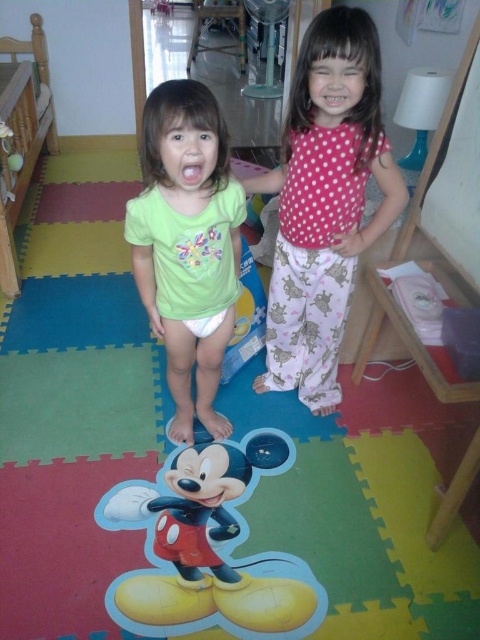
Is green matte shirt at center wider than wooden bed at left?

No, green matte shirt at center is not wider than wooden bed at left.

From the picture: Who is more forward, (214, 168) or (9, 61)?

Positioned in front is point (214, 168).

Is point (194, 264) behind point (6, 291)?

No.

Locate an element on the screen. Image resolution: width=480 pixels, height=640 pixels. green matte shirt at center is located at coordinates coord(188,243).

Can you confirm if pink dotted pajamas at center is positioned below wooden bed at left?

Correct, pink dotted pajamas at center is located below wooden bed at left.

Can you confirm if pink dotted pajamas at center is wider than wooden bed at left?

No, pink dotted pajamas at center is not wider than wooden bed at left.

Which is behind, point (285, 282) or point (35, 56)?

Positioned behind is point (35, 56).

I want to click on pink dotted pajamas at center, so click(324, 202).

Can you confirm if green matte shirt at center is positioned below shiny plastic mickey mouse at center?

No, green matte shirt at center is not below shiny plastic mickey mouse at center.

Does green matte shirt at center come behind shiny plastic mickey mouse at center?

No, it is in front of shiny plastic mickey mouse at center.

Is point (223, 268) farther from viewer compared to point (222, 449)?

No, it is not.

You are a GUI agent. You are given a task and a screenshot of the screen. Output one action in this format:
    pyautogui.click(x=<x>, y=<y>)
    Task: Click on the green matte shirt at center
    This screenshot has height=640, width=480.
    Given the screenshot: What is the action you would take?
    pyautogui.click(x=188, y=243)